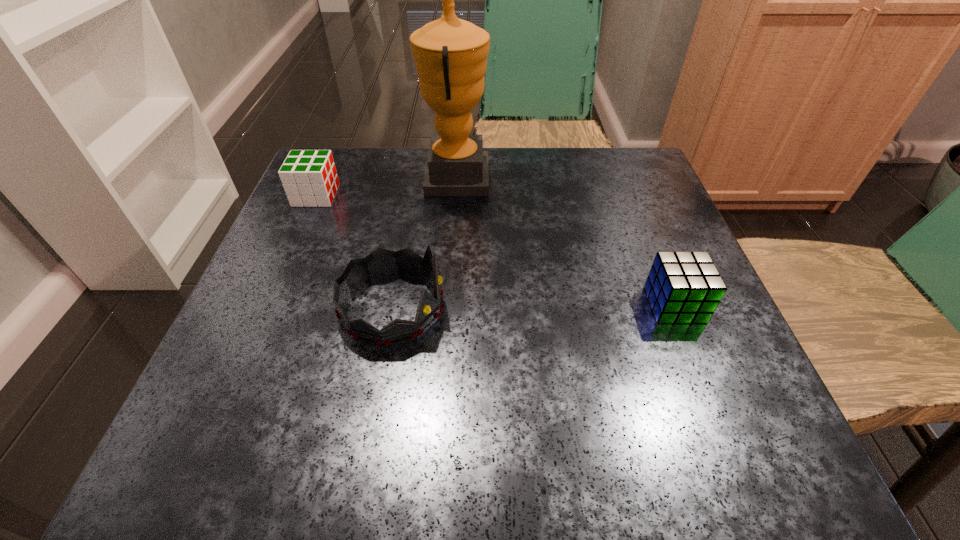
This screenshot has width=960, height=540. Identify the location of the tallest object. (450, 54).

I want to click on the second tallest object, so click(x=381, y=262).

In order to click on the leftmost object in this screenshot , I will do `click(309, 177)`.

Identify the location of the farther cube. This screenshot has width=960, height=540. (309, 177).

This screenshot has width=960, height=540. Find the location of `the rightmost object`. the rightmost object is located at coordinates (683, 287).

I want to click on the right cube, so click(x=683, y=287).

Image resolution: width=960 pixels, height=540 pixels. I want to click on free space located 0.300m at the front of the award with handles, so click(x=624, y=178).

The image size is (960, 540). I want to click on free spot located at the front of the third shortest object with jewels, so click(488, 308).

This screenshot has width=960, height=540. I want to click on vacant position located on the red face of the left cube, so click(383, 195).

Locate an element on the screen. The image size is (960, 540). vacant area situated 0.180m on the front of the rightmost object is located at coordinates (727, 434).